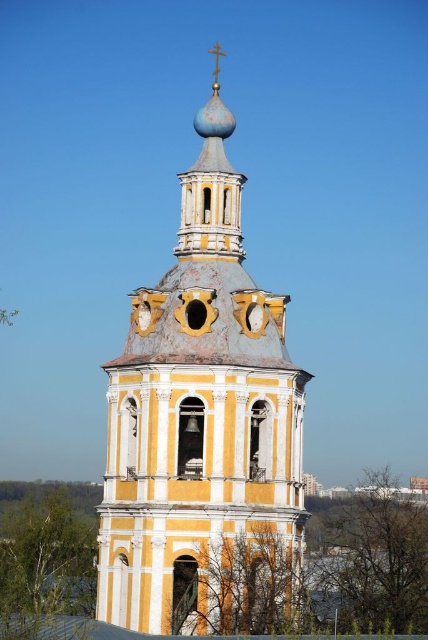
Can you confirm if yellow painted wood bell tower at center is positioned below gold-painted wood spire at center?

Indeed, yellow painted wood bell tower at center is positioned under gold-painted wood spire at center.

Identify the location of yellow painted wood bell tower at center. This screenshot has width=428, height=640. (204, 429).